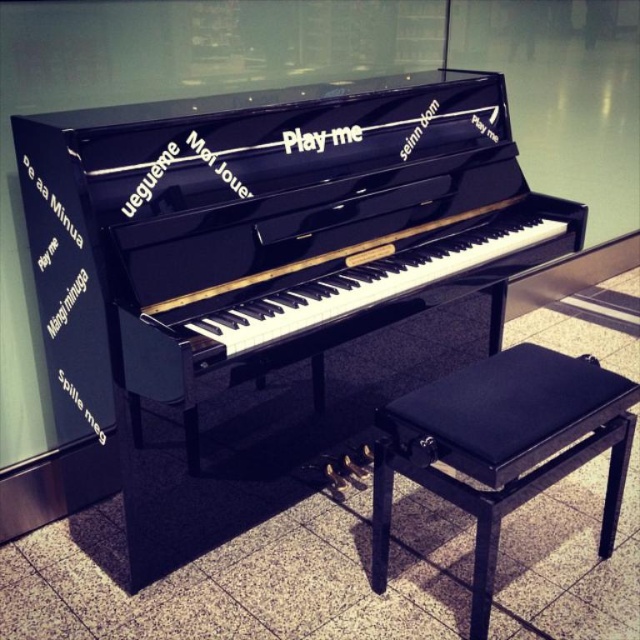
Question: Which point appears closest to the camera in this image?

Choices:
 (A) (625, 392)
 (B) (60, 225)

Answer: (B)

Question: Does black leather music stool at center appear under black glossy text at left?

Choices:
 (A) yes
 (B) no

Answer: (A)

Question: Where is black polished piano at center located in relation to black leather music stool at center in the image?

Choices:
 (A) below
 (B) above

Answer: (B)

Question: Which point is farther from the camera taking this photo?

Choices:
 (A) (156, 308)
 (B) (376, 499)
 (C) (531, 387)

Answer: (B)

Question: Can you confirm if black leather footrest at lower center is bigger than black glossy text at left?

Choices:
 (A) yes
 (B) no

Answer: (B)

Question: Among these objects, which one is nearest to the camera?

Choices:
 (A) black leather footrest at lower center
 (B) black glossy text at left

Answer: (A)